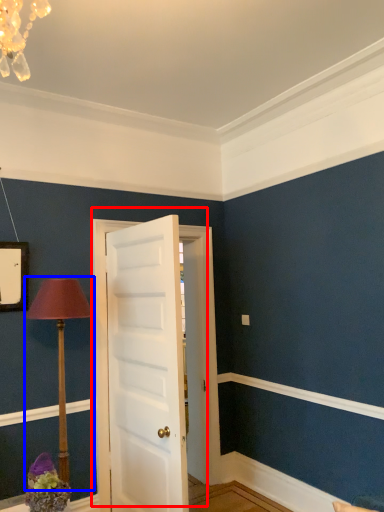
Question: Which object appears farthest to the camera in this image, door (highlighted by a red box) or table lamp (highlighted by a blue box)?

Choices:
 (A) door
 (B) table lamp

Answer: (A)